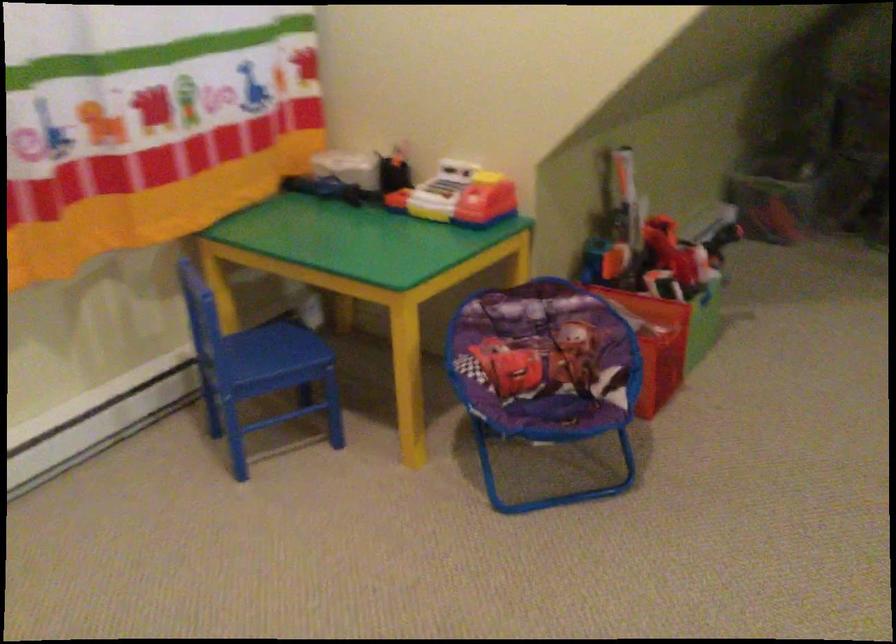
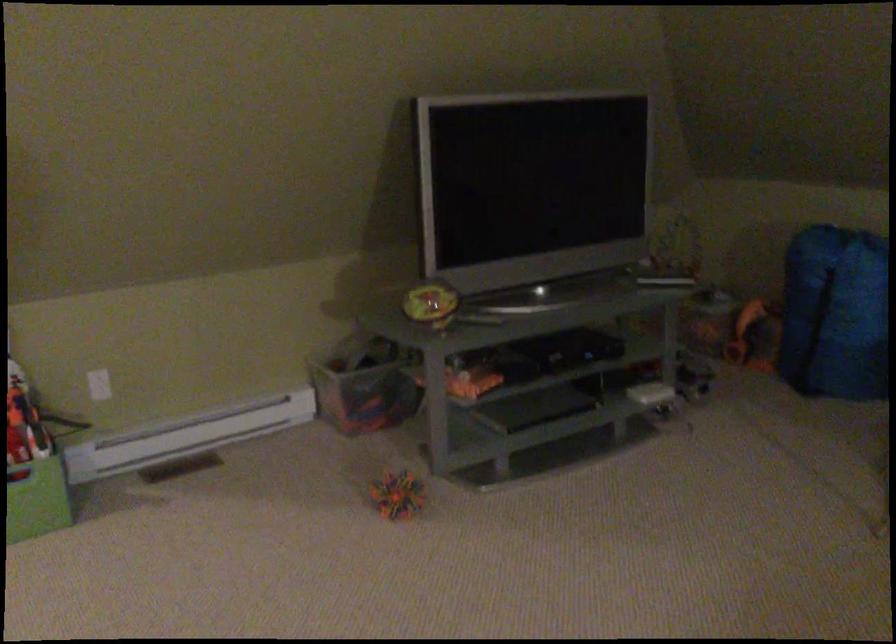
The point at (650, 204) is marked in the first image. Where is the corresponding point in the second image?

(99, 384)